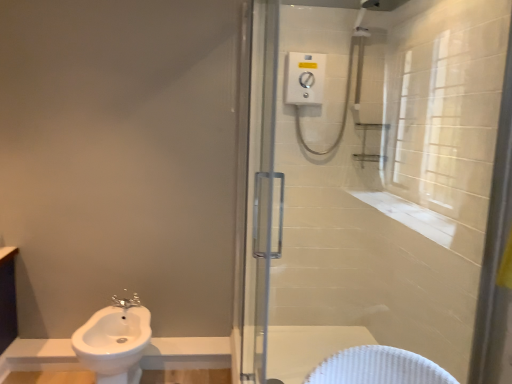
You are a GUI agent. You are given a task and a screenshot of the screen. Output one action in this format:
    pyautogui.click(x=<x>, y=<y>)
    Task: Click on the vacant space in front of satin nickel faucet at lower left
    
    Given the screenshot: What is the action you would take?
    pyautogui.click(x=128, y=317)